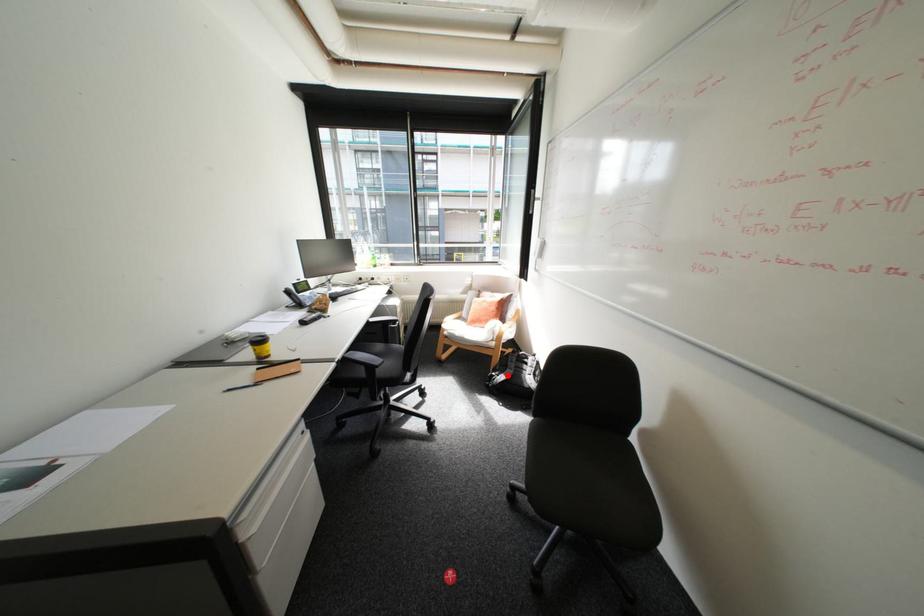
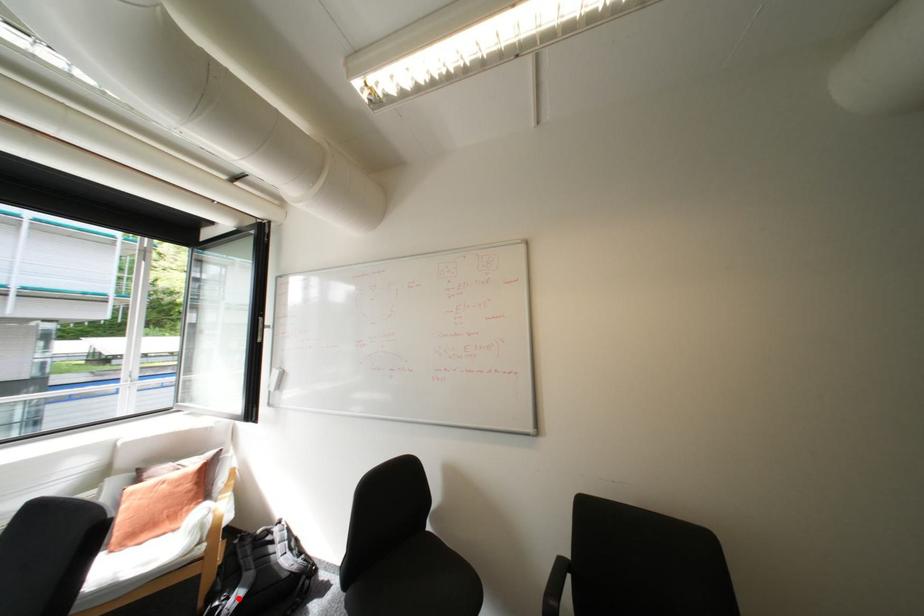
I am providing you with two images of the same scene from different viewpoints. A red point is marked on the first image and another point is marked on the second image. Are the points marked in image1 and image2 representing the same 3D position?

Yes